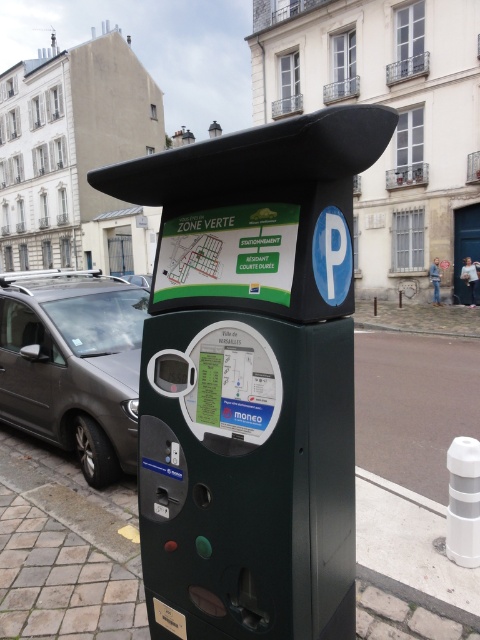
Question: Estimate the real-world distances between objects in this image. Which object is closer to the dark gray metallic van at left?

Choices:
 (A) dark gray paving stone at lower left
 (B) green plastic parking meter at center

Answer: (A)

Question: Does green plastic parking meter at center appear on the right side of dark gray metallic van at left?

Choices:
 (A) yes
 (B) no

Answer: (A)

Question: Does green plastic parking meter at center have a greater width compared to dark gray metallic van at left?

Choices:
 (A) no
 (B) yes

Answer: (A)

Question: Can you confirm if dark gray paving stone at lower left is positioned to the right of dark gray metallic van at left?

Choices:
 (A) yes
 (B) no

Answer: (A)

Question: Which point appears farthest from the camera in this image?

Choices:
 (A) (11, 337)
 (B) (66, 621)
 (C) (181, 433)

Answer: (A)

Question: Which point is farther to the camera?

Choices:
 (A) (x=118, y=538)
 (B) (x=52, y=436)
 (C) (x=167, y=257)

Answer: (B)